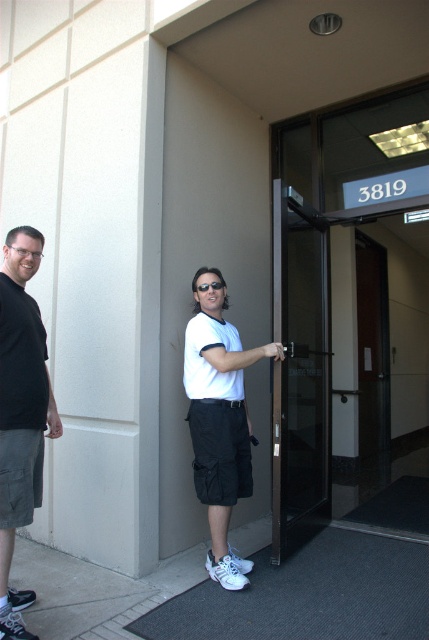
Question: Among these points, which one is farthest from the camera?

Choices:
 (A) (299, 312)
 (B) (217, 282)

Answer: (A)

Question: From the image, what is the correct spatial relationship of black glass door at center in relation to black cotton shirt at left?

Choices:
 (A) below
 (B) above

Answer: (B)

Question: Which of the following is the closest to the observer?

Choices:
 (A) transparent glass elevator at center
 (B) black cotton shirt at left
 (C) black glass door at center
 (D) white matte shirt at center

Answer: (B)

Question: Among these points, which one is nearest to the camera?

Choices:
 (A) (425, 410)
 (B) (193, 291)
 (C) (30, 429)
 (D) (195, 362)

Answer: (C)

Question: Does transparent glass elevator at center have a smaller size compared to white matte shirt at center?

Choices:
 (A) yes
 (B) no

Answer: (A)

Question: Does white matte shirt at center have a greater width compared to black cotton shirt at left?

Choices:
 (A) yes
 (B) no

Answer: (A)